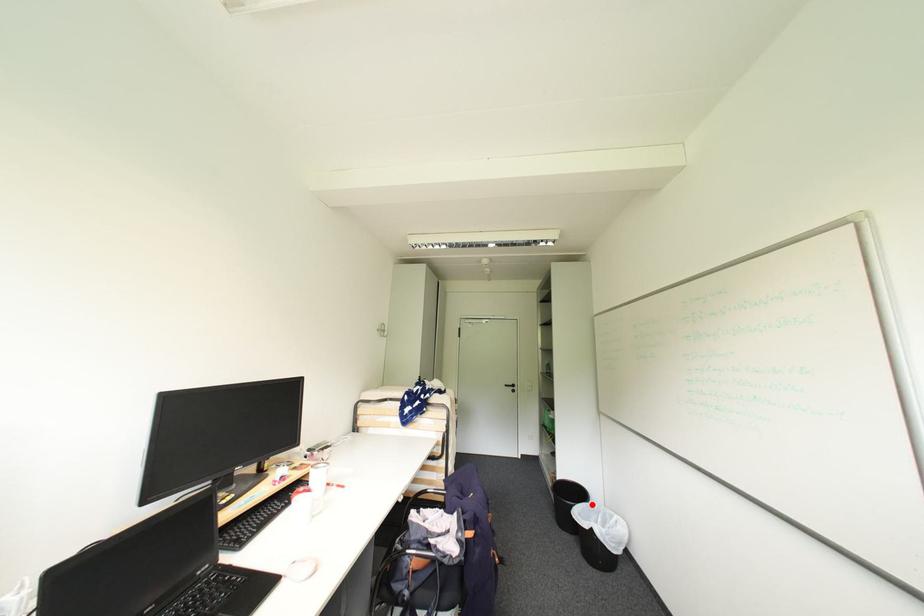
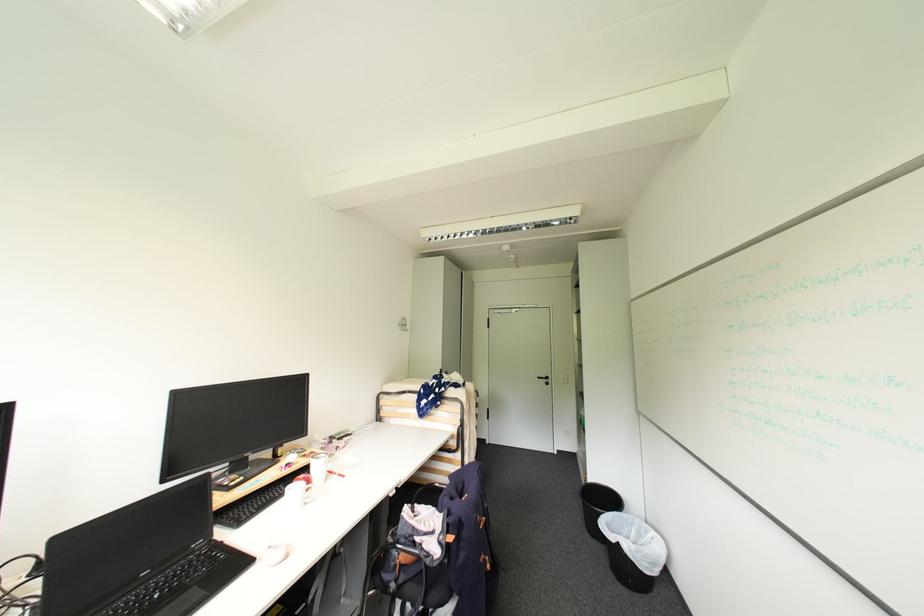
Where in the second image is the point corresponding to the highlighted location from the first image?

(624, 514)